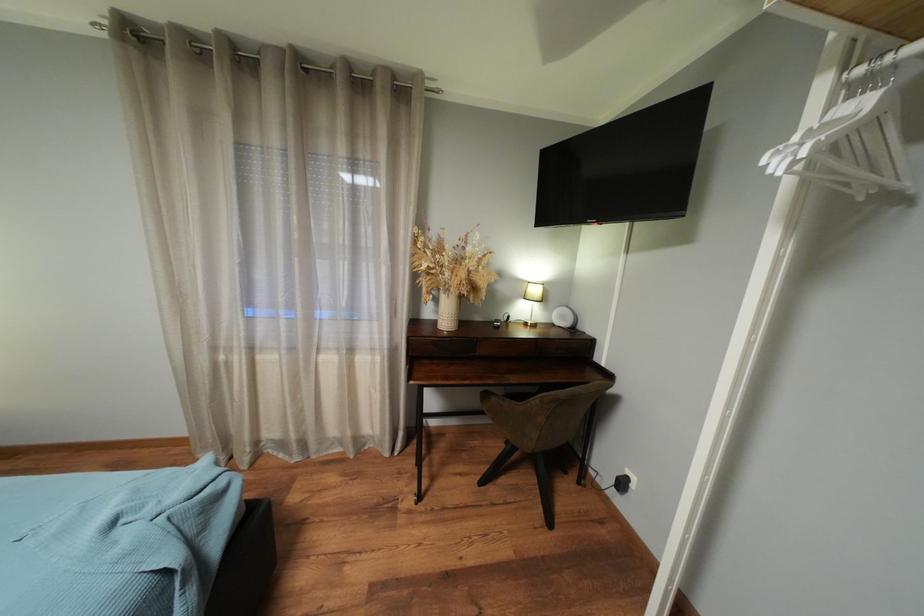
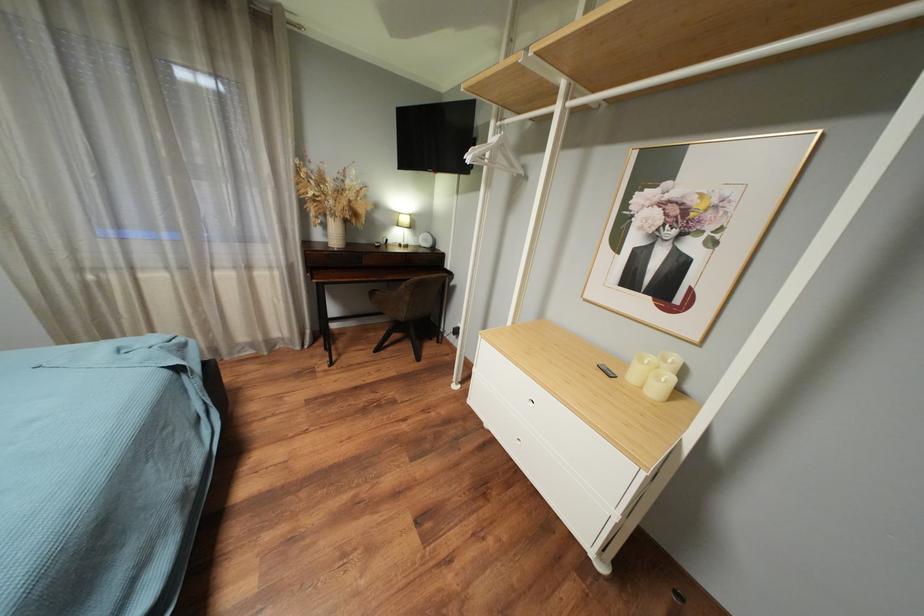
Question: The camera is either moving clockwise (left) or counter-clockwise (right) around the object. The first image is from the beginning of the video and the second image is from the end. Is the camera moving left or right when shooting the video?

Choices:
 (A) Left
 (B) Right

Answer: (A)